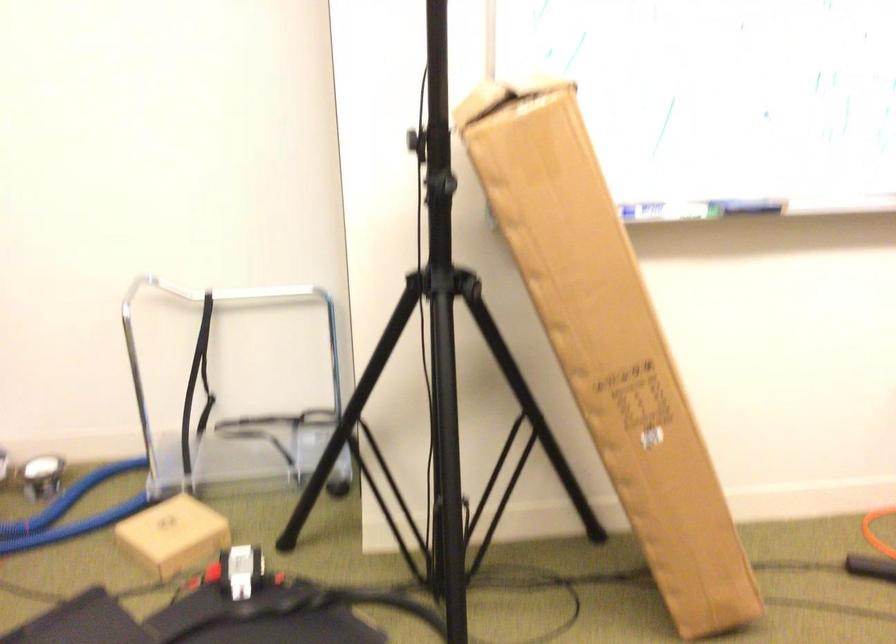
At what (x,y) coordinates should I click in order to perform the action: click on small cardboard box. Please return your answer as a coordinate pair (x, y). The width and height of the screenshot is (896, 644). Looking at the image, I should click on (242, 572).